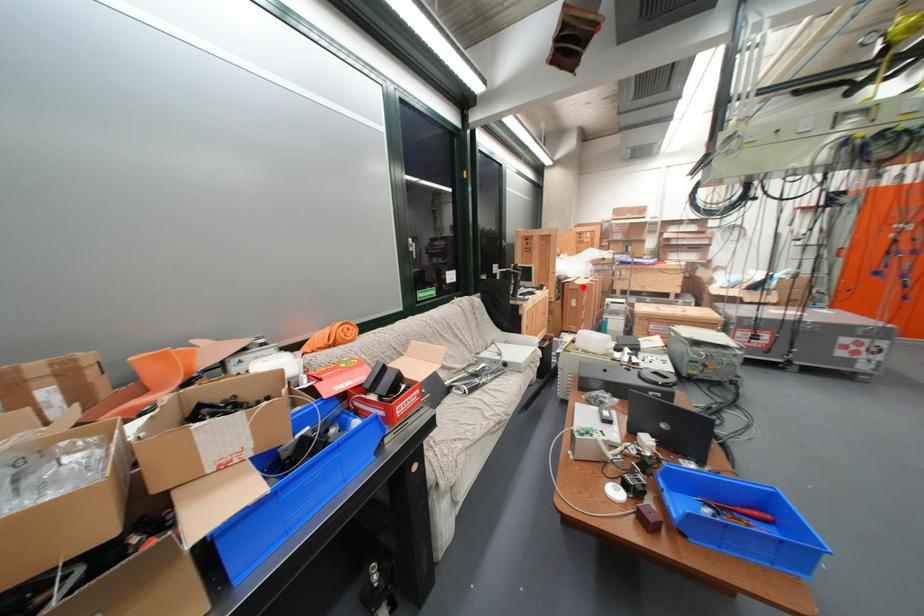
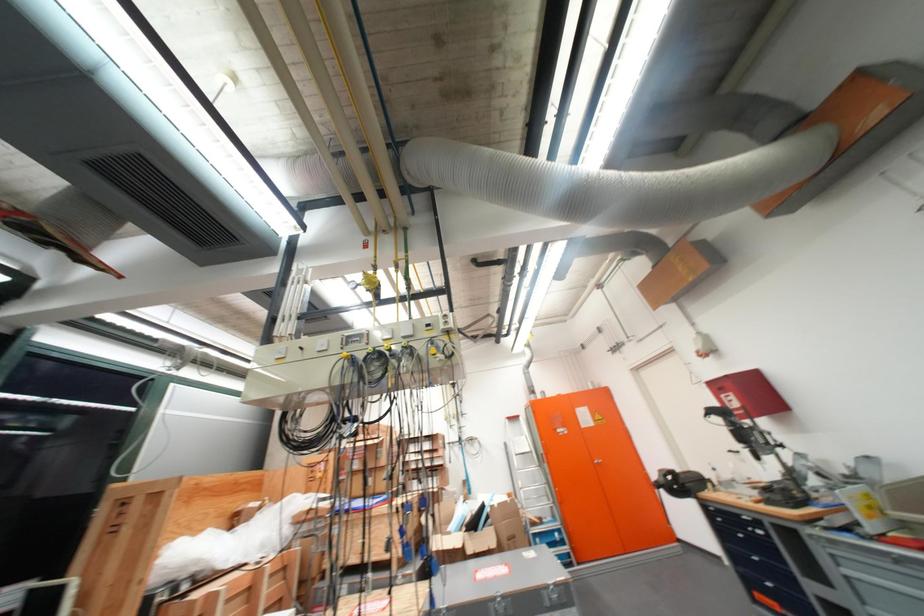
The point at the highlighted location is marked in the first image. Where is the corresponding point in the second image?

(187, 610)